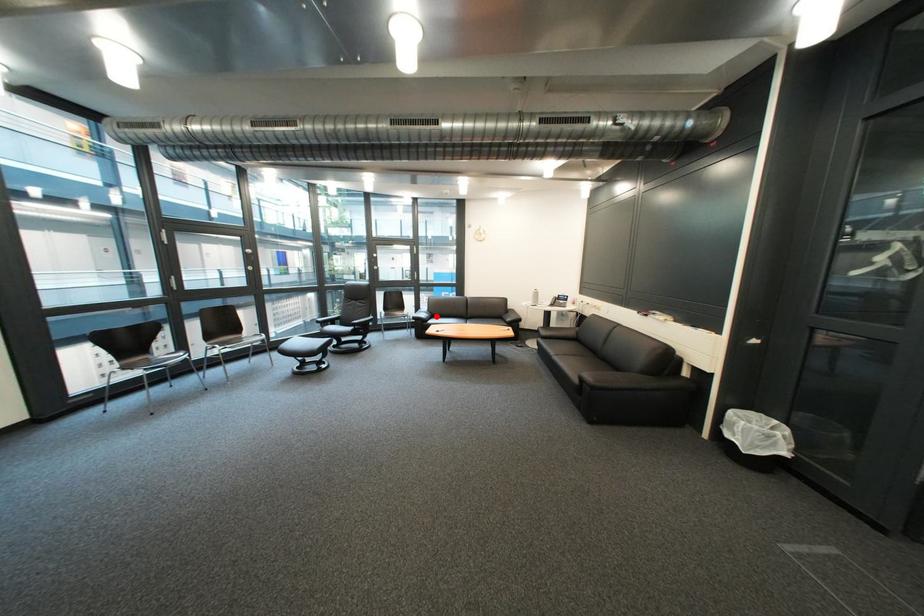
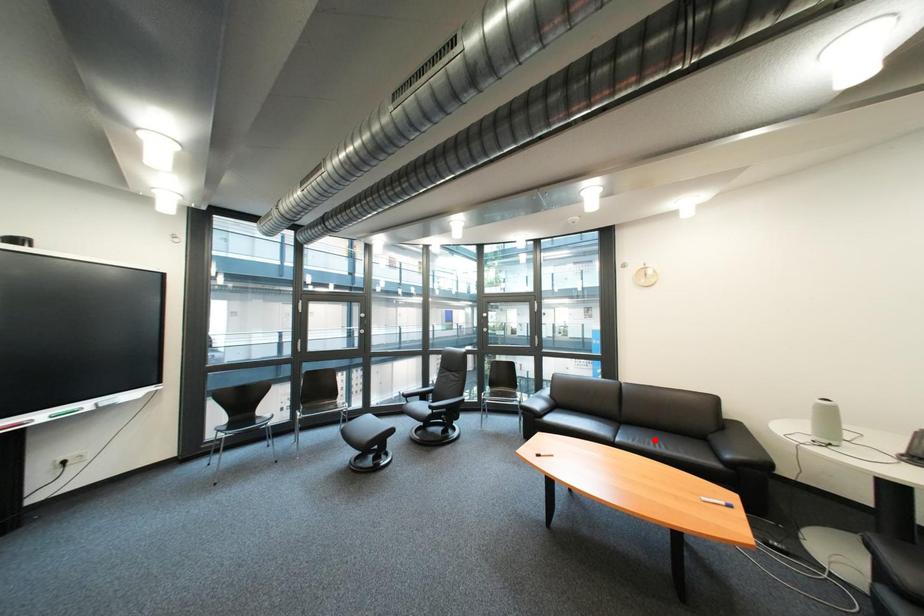
I am providing you with two images of the same scene from different viewpoints. A red point is marked on the first image and another point is marked on the second image. Are the points marked in image1 and image2 representing the same 3D position?

No